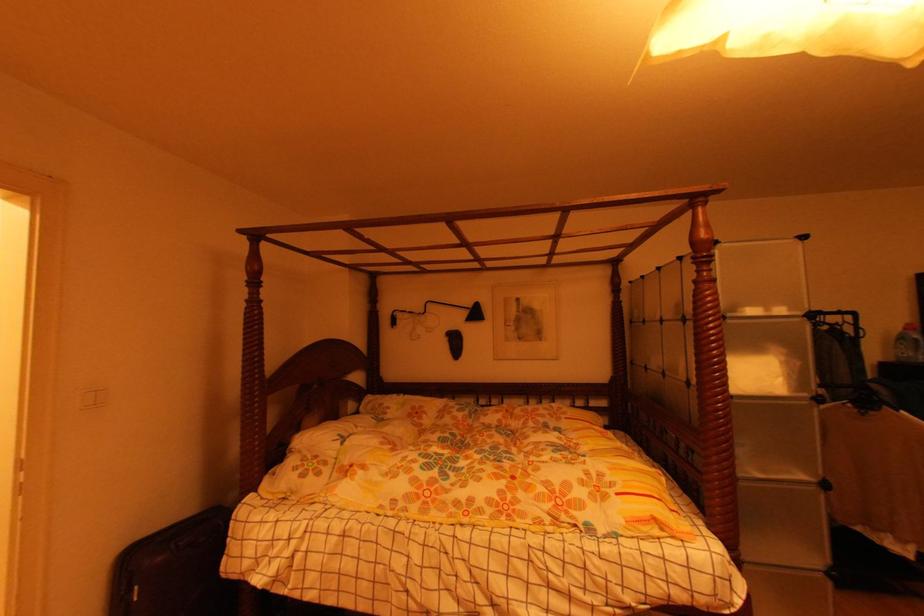
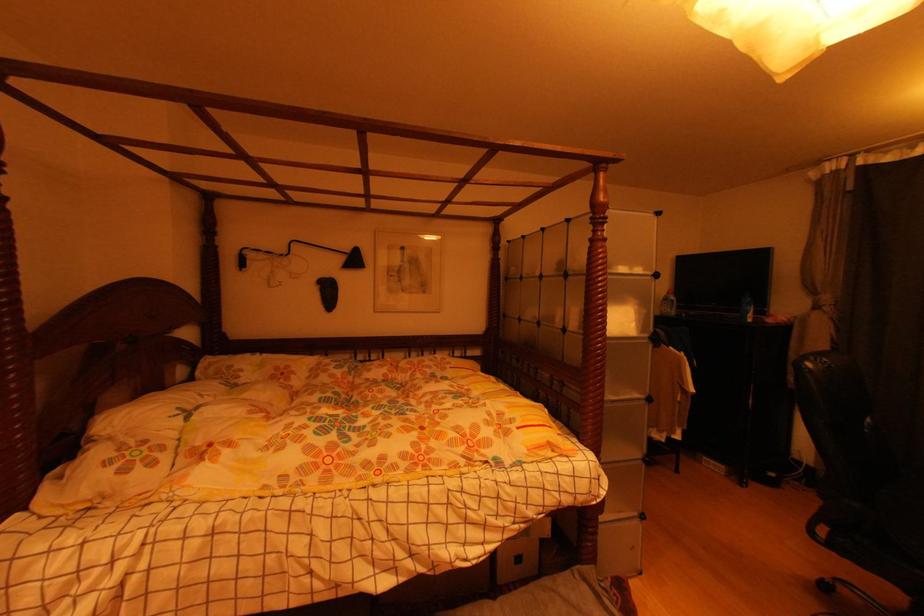
Question: I am providing you with two images of the same scene from different viewpoints. Which of the following objects are not visible in image2?

Choices:
 (A) storage cube handle
 (B) white detergent bottle
 (C) black lamp head
 (D) none of these

Answer: (D)